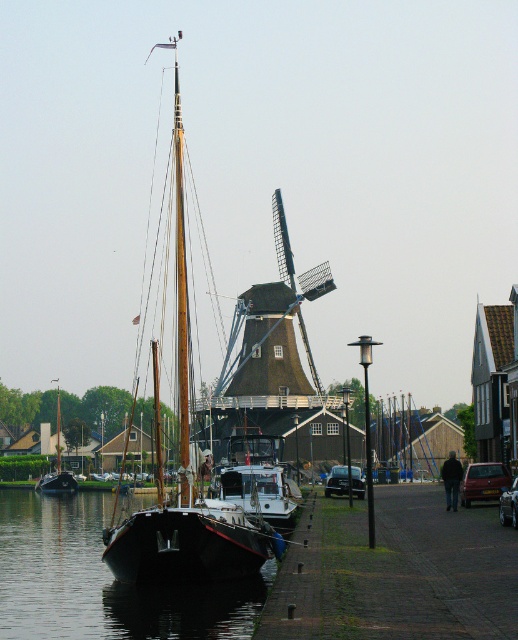
Question: Can you confirm if wooden sailboat at center is thinner than white matte boat at center?

Choices:
 (A) yes
 (B) no

Answer: (B)

Question: Which of the following is the farthest from the observer?

Choices:
 (A) (48, 474)
 (B) (214, 637)
 (C) (225, 534)

Answer: (A)

Question: Is wooden sailboat at center above wooden boat at left?

Choices:
 (A) no
 (B) yes

Answer: (B)

Question: Considering the relative positions of wooden sailboat at center and white matte boat at center in the image provided, where is wooden sailboat at center located with respect to white matte boat at center?

Choices:
 (A) right
 (B) left

Answer: (B)

Question: Which point appears closest to the camera in this image?

Choices:
 (A) (269, 468)
 (B) (228, 566)
 (C) (71, 625)

Answer: (C)

Question: Estimate the real-world distances between objects in this image. Which object is closer to the wooden sailboat at center?

Choices:
 (A) white matte boat at center
 (B) wooden boat at left
 (C) black glossy water at lower left

Answer: (A)